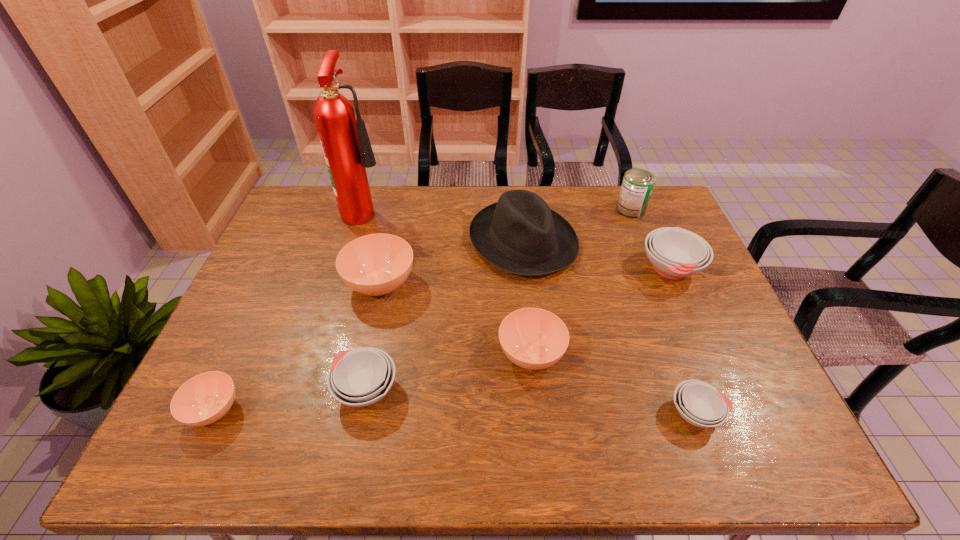
This screenshot has height=540, width=960. I want to click on vacant point at the far edge, so click(443, 192).

In the image, there is a desktop. Where is `vacant area at the near edge`? This screenshot has width=960, height=540. vacant area at the near edge is located at coordinates (244, 451).

Identify the location of vacant area at the left edge. (293, 302).

The width and height of the screenshot is (960, 540). Find the location of `free space at the right edge of the desktop`. free space at the right edge of the desktop is located at coordinates (735, 381).

In order to click on free space at the far left corner of the desktop in this screenshot , I will do `click(320, 215)`.

This screenshot has width=960, height=540. In order to click on free space at the far right corner of the desktop in this screenshot , I will do `click(675, 217)`.

Locate an element on the screen. Image resolution: width=960 pixels, height=540 pixels. vacant area that lies between the fedora and the farthest white soup bowl is located at coordinates (597, 255).

You are a GUI agent. You are given a task and a screenshot of the screen. Output one action in this format:
    pyautogui.click(x=<x>, y=<y>)
    Task: Click on the free space between the farthest white soup bowl and the fedora
    
    Given the screenshot: What is the action you would take?
    pyautogui.click(x=597, y=255)

The image size is (960, 540). In order to click on vacant space that is in between the second biggest peach soup bowl and the tallest object in this screenshot , I will do `click(448, 282)`.

The height and width of the screenshot is (540, 960). Find the location of `vacant space in between the fedora and the fourth soup bowl from left to right`. vacant space in between the fedora and the fourth soup bowl from left to right is located at coordinates (527, 298).